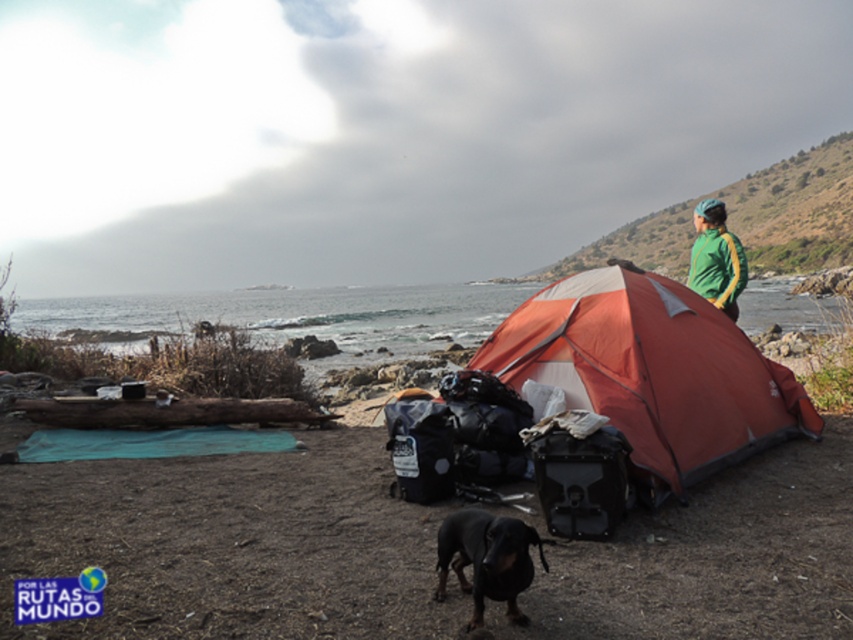
You are setting up a camera tripod at the coordinates where the black smooth dog at lower center is currently standing. The dog moves to the coordinates of the tent entrance. Will the tripod still be positioned where the dog was originally?

The black smooth dog at lower center was originally at point (486,560). Since the dog moved to the tent entrance, the tripod remains at the original coordinates where the dog was standing.

You are standing at the center of the image and want to move towards the orange nylon tent at center. Based on its 2D location coordinates, in which direction should you move relative to your current position?

The orange nylon tent at center is located at coordinates point (651,372). Since you are at the center of the image, which is typically at coordinates (426,320), you should move northeast to reach it.

You are a photographer standing at the camera position. You want to take a photo of both point [450,518] and point [705,244] in the camping scene. Which point is closer to your current position?

Point [450,518] is closer to the camera than point [705,244].